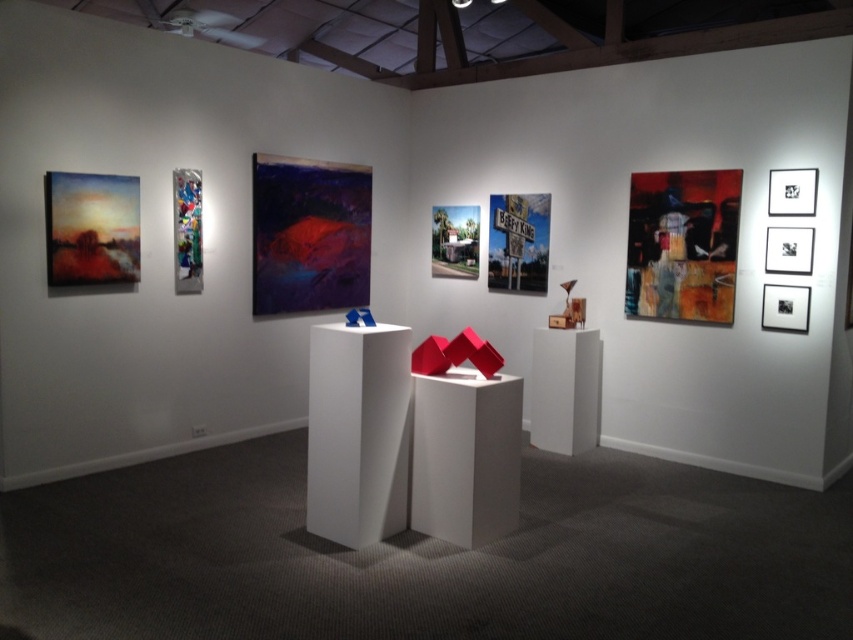
Measure the distance between point (x=502, y=211) and camera.

6.21 meters

Who is shorter, metallic street sign at center or metallic silver sign at center?

metallic silver sign at center is shorter.

Is point (498, 289) more distant than point (439, 253)?

No, (498, 289) is in front of (439, 253).

Find the location of a particular element. Image resolution: width=853 pixels, height=640 pixels. metallic street sign at center is located at coordinates (518, 243).

Does metallic street sign at center have a smaller size compared to metallic reflective sculpture at upper left?

Incorrect, metallic street sign at center is not smaller in size than metallic reflective sculpture at upper left.

Consider the image. Is metallic street sign at center thinner than metallic reflective sculpture at upper left?

No, metallic street sign at center is not thinner than metallic reflective sculpture at upper left.

The width and height of the screenshot is (853, 640). Find the location of `metallic street sign at center`. metallic street sign at center is located at coordinates (518, 243).

Does point (677, 304) come in front of point (109, 280)?

No, (677, 304) is behind (109, 280).

Who is positioned more to the left, abstract painting at upper right or matte oil painting at left?

matte oil painting at left is more to the left.

Between point (637, 186) and point (112, 177), which one is positioned in front?

Point (112, 177) is more forward.

Identify the location of abstract painting at upper right. The width and height of the screenshot is (853, 640). (682, 244).